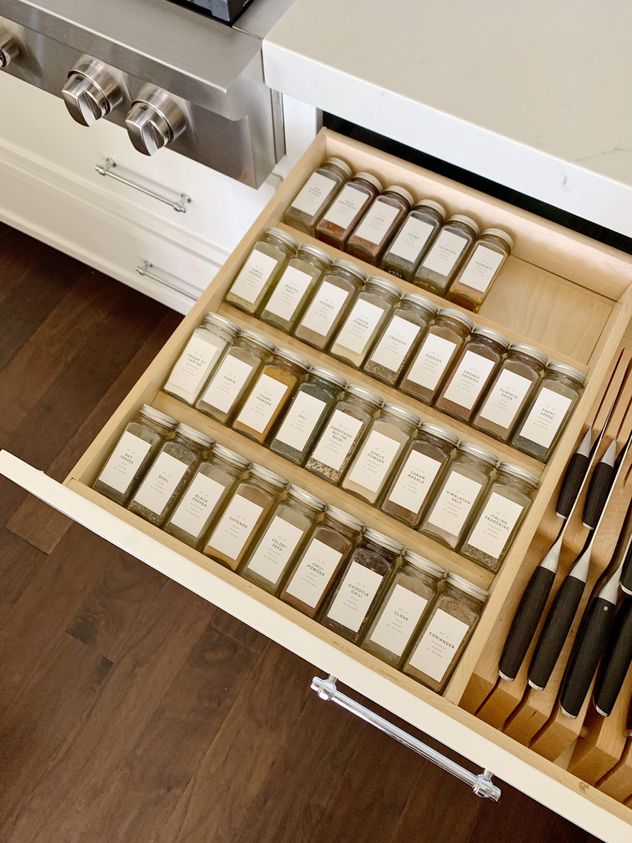
I want to click on knife handle, so click(x=599, y=695), click(x=573, y=685), click(x=552, y=661), click(x=525, y=648), click(x=592, y=498), click(x=569, y=492).